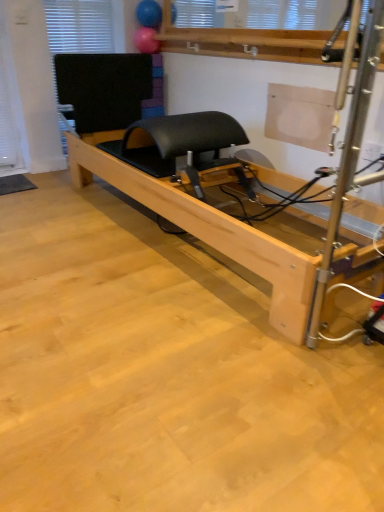
Question: From a real-world perspective, is black rubber yoga mat at lower left on top of rubberized blue ball at upper center, the 1th balloon from the top?

Choices:
 (A) yes
 (B) no

Answer: (B)

Question: Is black rubber yoga mat at lower left bigger than rubberized blue ball at upper center, positioned as the second balloon in bottom-to-top order?

Choices:
 (A) yes
 (B) no

Answer: (B)

Question: Could rubberized blue ball at upper center, positioned as the second balloon in bottom-to-top order, be considered to be inside black rubber yoga mat at lower left?

Choices:
 (A) no
 (B) yes

Answer: (A)

Question: Is black rubber yoga mat at lower left shorter than rubberized blue ball at upper center, positioned as the second balloon in bottom-to-top order?

Choices:
 (A) yes
 (B) no

Answer: (A)

Question: Does black rubber yoga mat at lower left appear on the left side of rubberized blue ball at upper center, positioned as the second balloon in bottom-to-top order?

Choices:
 (A) yes
 (B) no

Answer: (A)

Question: Is rubberized blue ball at upper center, positioned as the second balloon in bottom-to-top order, inside the boundaries of rubber ball at upper center, positioned as the first balloon in bottom-to-top order, or outside?

Choices:
 (A) outside
 (B) inside

Answer: (A)

Question: Considering the positions of rubberized blue ball at upper center, positioned as the second balloon in bottom-to-top order, and rubber ball at upper center, which is the 2th balloon from top to bottom, in the image, is rubberized blue ball at upper center, positioned as the second balloon in bottom-to-top order, bigger or smaller than rubber ball at upper center, which is the 2th balloon from top to bottom,?

Choices:
 (A) big
 (B) small

Answer: (A)

Question: From the image's perspective, is rubberized blue ball at upper center, the 1th balloon from the top, positioned above or below rubber ball at upper center, positioned as the first balloon in bottom-to-top order?

Choices:
 (A) above
 (B) below

Answer: (A)

Question: Considering their positions, is rubberized blue ball at upper center, the 1th balloon from the top, located in front of or behind rubber ball at upper center, which is the 2th balloon from top to bottom?

Choices:
 (A) front
 (B) behind

Answer: (A)

Question: From a real-world perspective, is black matte window at upper left above or below rubberized blue ball at upper center, the 1th balloon from the top?

Choices:
 (A) above
 (B) below

Answer: (B)

Question: Relative to rubberized blue ball at upper center, the 1th balloon from the top, is black matte window at upper left in front or behind?

Choices:
 (A) front
 (B) behind

Answer: (A)

Question: Is point (61, 125) positioned closer to the camera than point (135, 16)?

Choices:
 (A) closer
 (B) farther

Answer: (A)

Question: Do you think black matte window at upper left is within rubberized blue ball at upper center, the 1th balloon from the top, or outside of it?

Choices:
 (A) outside
 (B) inside

Answer: (A)

Question: Relative to natural wood pilates reformer at center, is rubber ball at upper center, which is the 2th balloon from top to bottom, in front or behind?

Choices:
 (A) front
 (B) behind

Answer: (B)

Question: Is rubber ball at upper center, which is the 2th balloon from top to bottom, taller or shorter than natural wood pilates reformer at center?

Choices:
 (A) tall
 (B) short

Answer: (B)